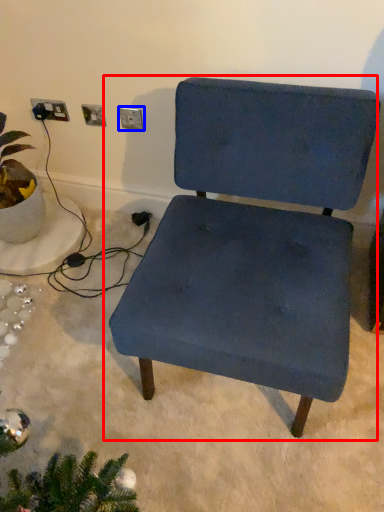
Question: Which object is closer to the camera taking this photo, chair (highlighted by a red box) or electric outlet (highlighted by a blue box)?

Choices:
 (A) chair
 (B) electric outlet

Answer: (A)